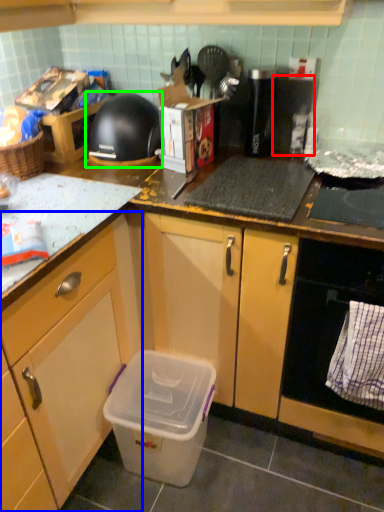
Question: Based on their relative distances, which object is nearer to appliance (highlighted by a red box)? Choose from cabinetry (highlighted by a blue box) and kitchen appliance (highlighted by a green box).

Choices:
 (A) cabinetry
 (B) kitchen appliance

Answer: (B)